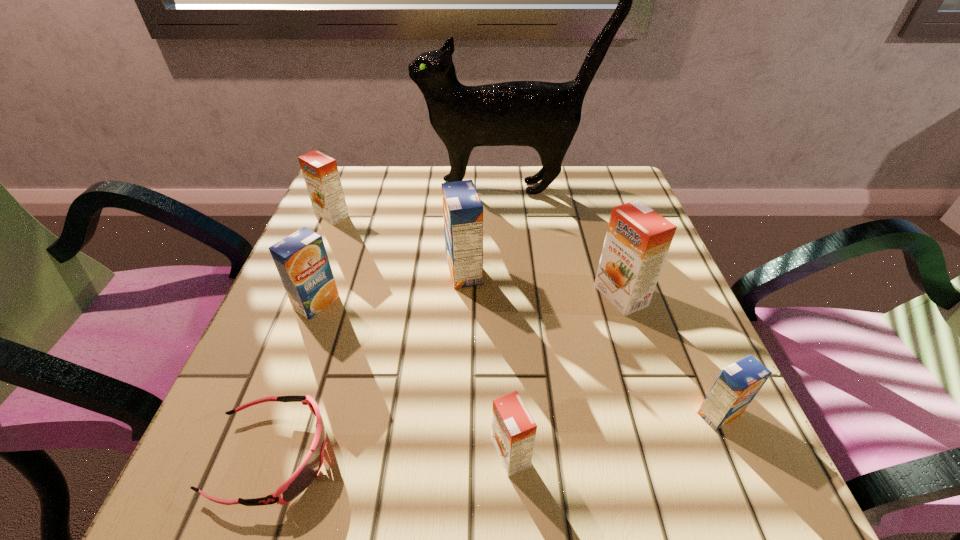
Locate an element on the screen. This screenshot has height=540, width=960. unoccupied area between the fourth orange juice from left to right and the second smallest orange orange juice is located at coordinates (421, 335).

Find the location of a particular element. The height and width of the screenshot is (540, 960). free space between the third orange juice from right to left and the cat is located at coordinates (509, 321).

At what (x,y) coordinates should I click in order to perform the action: click on free space between the second orange orange juice from right to left and the leftmost blue orange_juice. Please return your answer as a coordinate pair (x, y). Image resolution: width=960 pixels, height=540 pixels. Looking at the image, I should click on (414, 379).

Locate an element on the screen. free space between the biggest blue orange_juice and the second farthest orange orange juice is located at coordinates (542, 284).

The image size is (960, 540). I want to click on free point between the second biggest blue orange_juice and the farthest object, so click(x=413, y=245).

At what (x,y) coordinates should I click in order to perform the action: click on free space between the tallest object and the second orange orange juice from left to right. Please return your answer as a coordinate pair (x, y). This screenshot has width=960, height=540. Looking at the image, I should click on (509, 321).

In order to click on vacant area that lies between the biggest orange orange juice and the tallest object in this screenshot , I will do `click(564, 242)`.

Where is `free space between the second orange orange juice from right to left and the second farthest object`? This screenshot has height=540, width=960. free space between the second orange orange juice from right to left and the second farthest object is located at coordinates coord(421,335).

Where is `free space between the rightmost orange orange juice and the shortest object`? The height and width of the screenshot is (540, 960). free space between the rightmost orange orange juice and the shortest object is located at coordinates (446, 376).

At what (x,y) coordinates should I click in order to perform the action: click on object that is the sixth closest to the pink goggles. Please return your answer as a coordinate pair (x, y). This screenshot has width=960, height=540. Looking at the image, I should click on (737, 385).